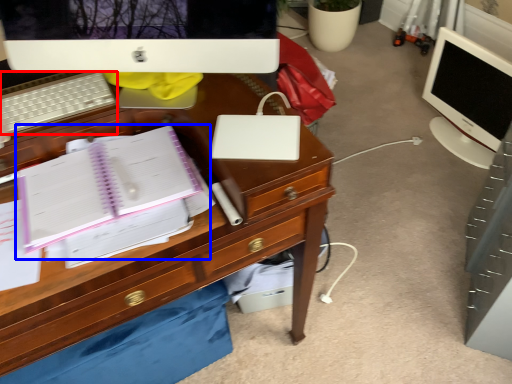
Question: Which of the following is the closest to the observer, computer keyboard (highlighted by a red box) or notebook (highlighted by a blue box)?

Choices:
 (A) computer keyboard
 (B) notebook

Answer: (B)